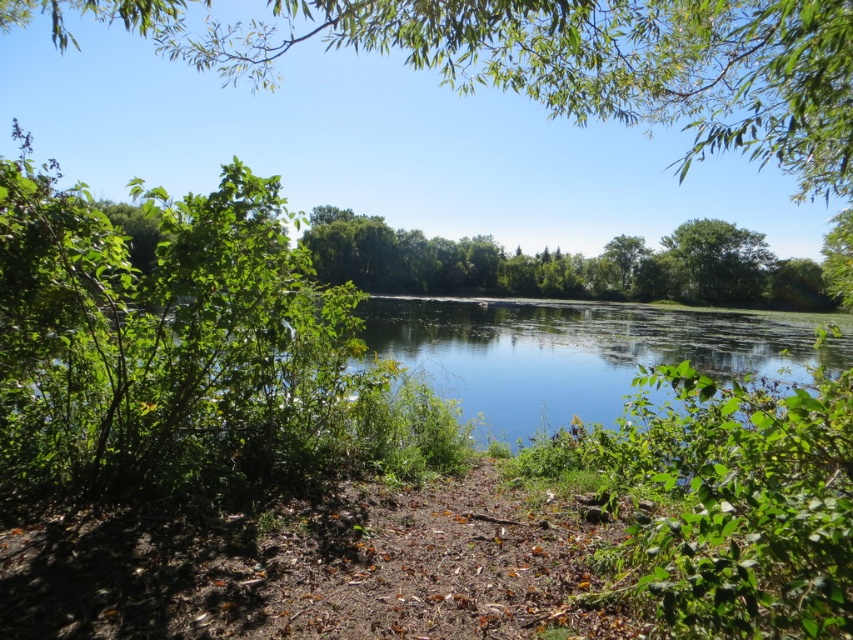
You are a hiker who wants to take a photo of the clear blue water at center and the green leafy tree at upper center. Which object should you focus on first if you want to capture both in one frame?

You should focus on the green leafy tree at upper center first because it is positioned above the clear blue water at center, so adjusting the focus to the tree will help ensure both are in the frame.

You are standing on the dirt path in the lower center of the image. To your left, you see the clear blue water at center and the green leafy tree at upper right. Which object is positioned to the left of the other?

The clear blue water at center is to the left of the green leafy tree at upper right.